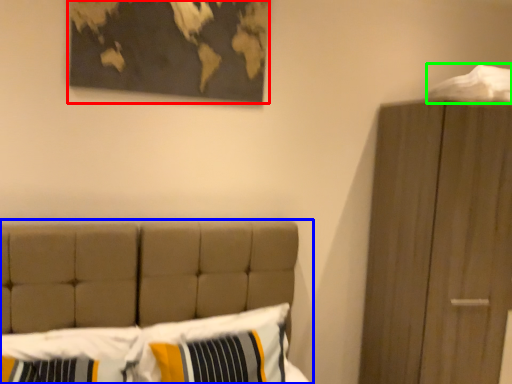
Question: Which object is positioned closest to picture frame (highlighted by a red box)? Select from bed (highlighted by a blue box) and sheet (highlighted by a green box).

Choices:
 (A) bed
 (B) sheet

Answer: (A)